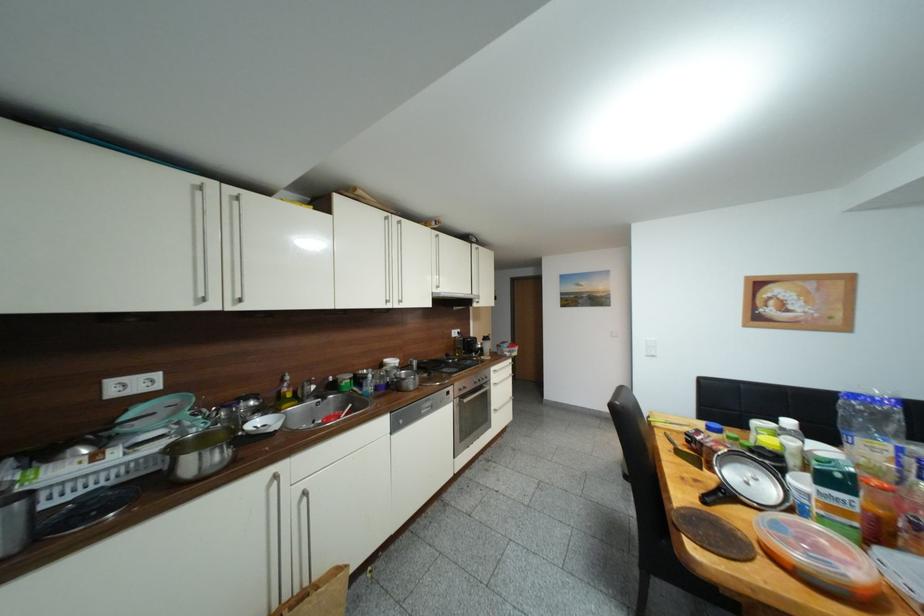
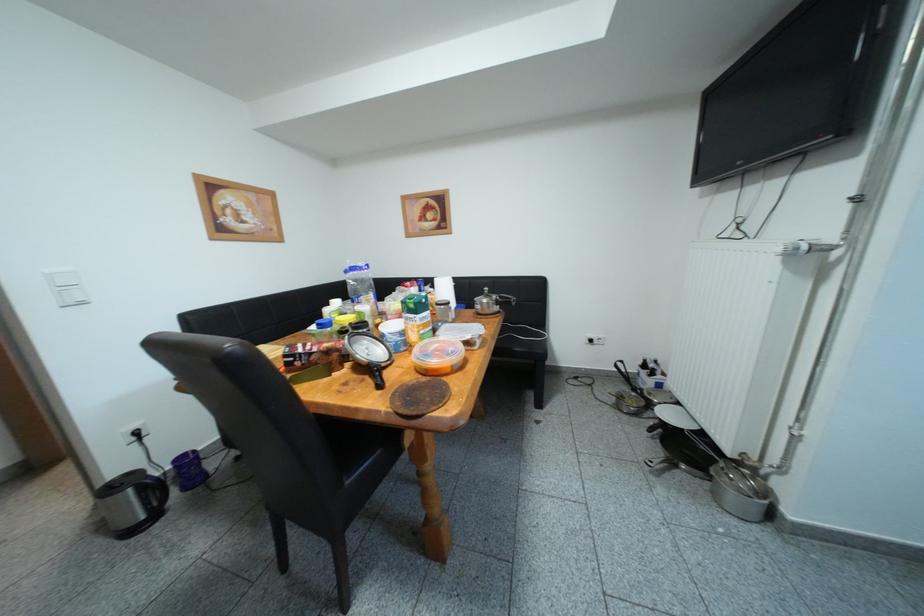
Question: The first image is from the beginning of the video and the second image is from the end. How did the camera likely rotate when shooting the video?

Choices:
 (A) Left
 (B) Right
 (C) Up
 (D) Down

Answer: (B)